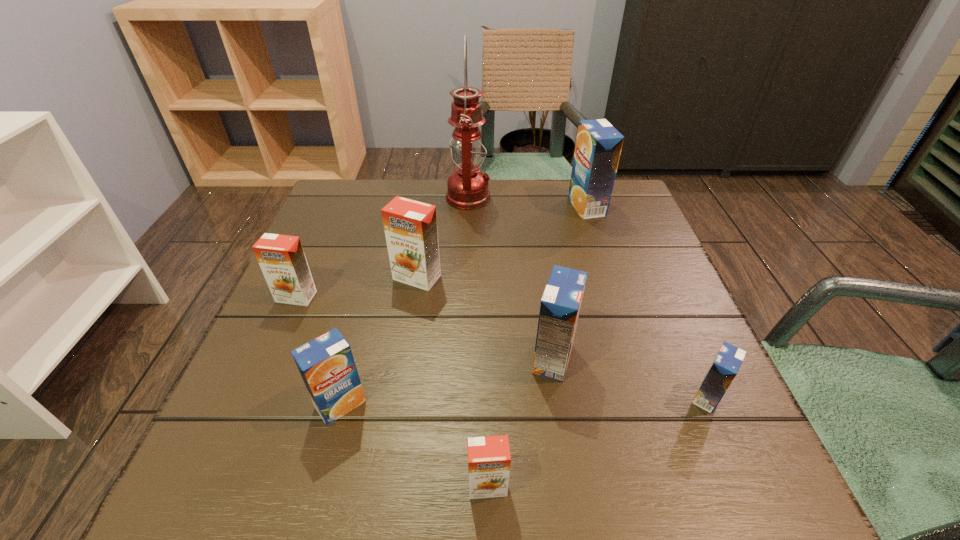
Image resolution: width=960 pixels, height=540 pixels. In order to click on vacant area that lies between the second orange orange juice from right to left and the seventh shortest object in this screenshot , I will do [502, 242].

The width and height of the screenshot is (960, 540). What are the coordinates of `object that stands as the fifth closest to the third smallest blue orange_juice` in the screenshot? It's located at point(598,147).

Find the location of a particular element. The height and width of the screenshot is (540, 960). object that can be found as the second closest to the oil lamp is located at coordinates (598, 147).

Locate which orange juice ranks second in proximity to the third blue orange_juice from left to right. Please provide its 2D coordinates. Your answer should be formatted as a tuple, i.e. [(x, y)], where the tuple contains the x and y coordinates of a point satisfying the conditions above.

[(560, 305)]

Identify which orange juice is the fourth closest to the rightmost object. Please provide its 2D coordinates. Your answer should be formatted as a tuple, i.e. [(x, y)], where the tuple contains the x and y coordinates of a point satisfying the conditions above.

[(598, 147)]

In order to click on blue orange_juice object that ranks as the fourth closest to the oil lamp in this screenshot , I will do `click(725, 366)`.

Locate which blue orange_juice ranks in proximity to the smallest orange orange juice. Please provide its 2D coordinates. Your answer should be formatted as a tuple, i.e. [(x, y)], where the tuple contains the x and y coordinates of a point satisfying the conditions above.

[(560, 305)]

Image resolution: width=960 pixels, height=540 pixels. Identify the location of orange orange juice that can be found as the second closest to the red oil lamp. (281, 258).

The width and height of the screenshot is (960, 540). What are the coordinates of `orange orange juice object that ranks as the second closest to the biggest orange orange juice` in the screenshot? It's located at (489, 458).

Where is `free space that satisfies the following two spatial constraints: 1. on the back side of the second orange orange juice from left to right; 2. on the left side of the third biggest blue orange_juice`? The height and width of the screenshot is (540, 960). free space that satisfies the following two spatial constraints: 1. on the back side of the second orange orange juice from left to right; 2. on the left side of the third biggest blue orange_juice is located at coordinates (374, 278).